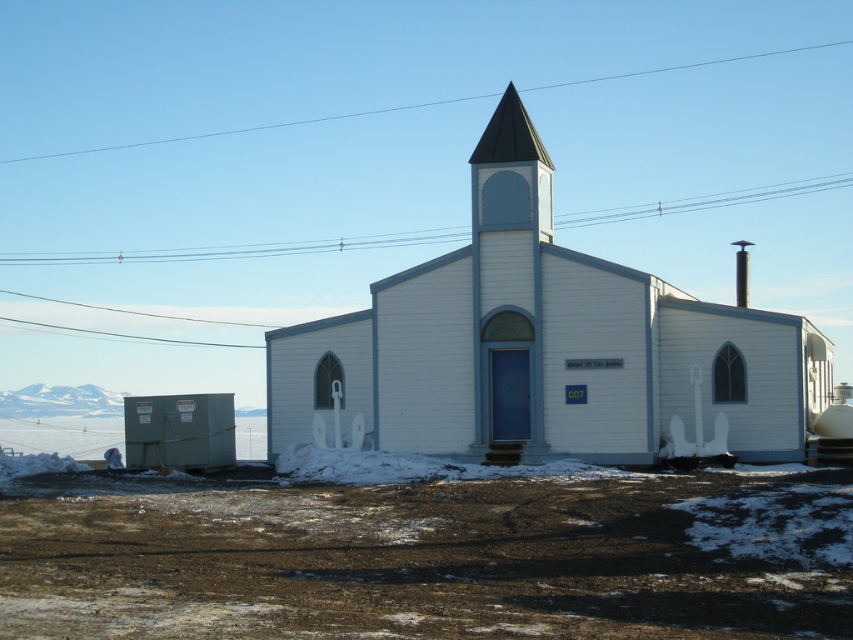
Question: Does white wood church at center come in front of shiny dark gray spire at center?

Choices:
 (A) no
 (B) yes

Answer: (B)

Question: Which of the following is the farthest from the observer?

Choices:
 (A) shiny dark gray spire at center
 (B) white wood church at center

Answer: (A)

Question: Which point is farther to the camera?

Choices:
 (A) (540, 147)
 (B) (657, 433)

Answer: (A)

Question: Can you confirm if white wood church at center is smaller than shiny dark gray spire at center?

Choices:
 (A) yes
 (B) no

Answer: (B)

Question: Which object is closer to the camera taking this photo?

Choices:
 (A) white wood church at center
 (B) shiny dark gray spire at center

Answer: (A)

Question: Can you confirm if white wood church at center is wider than shiny dark gray spire at center?

Choices:
 (A) yes
 (B) no

Answer: (A)